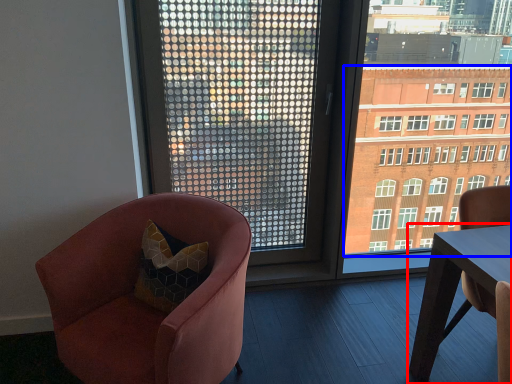
Question: Which object is closer to the camera taking this photo, table (highlighted by a red box) or condominium (highlighted by a blue box)?

Choices:
 (A) table
 (B) condominium

Answer: (A)